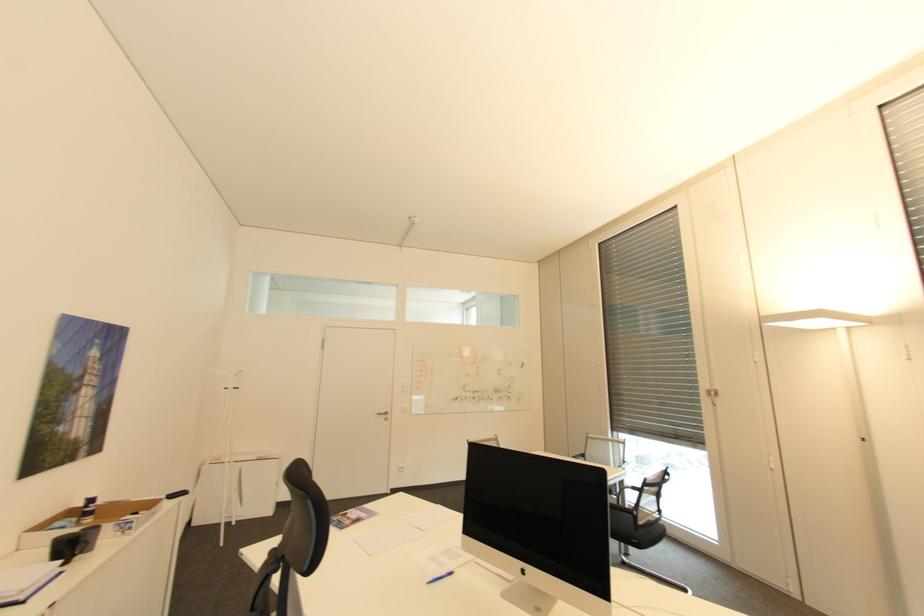
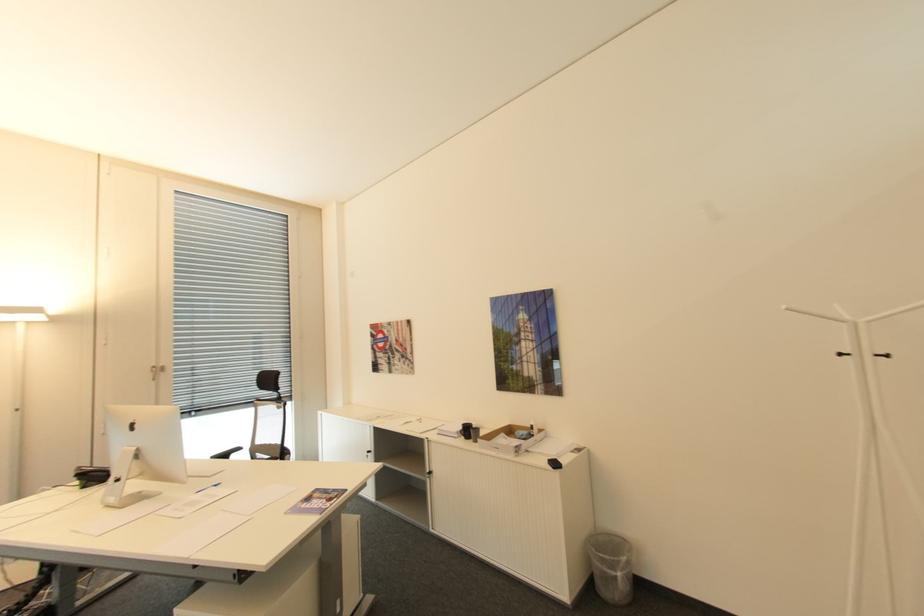
Find the pixel in the second image that matches pixel 248 369 in the first image.

(791, 307)